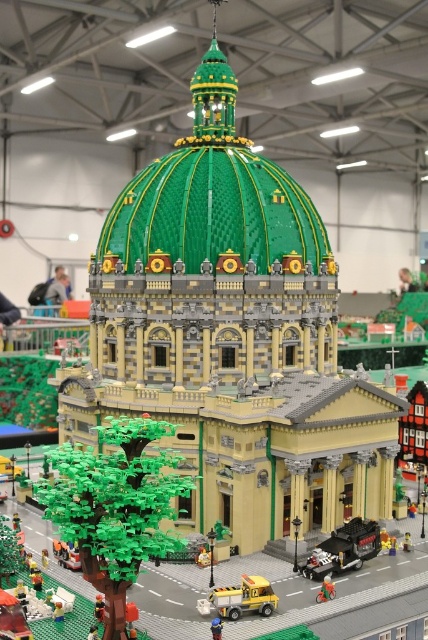
Question: Does dark gray plastic truck at center appear on the left side of brick-like toy car at lower left?

Choices:
 (A) yes
 (B) no

Answer: (B)

Question: Is green plastic tree at lower left to the right of metallic silver bicycle at center from the viewer's perspective?

Choices:
 (A) no
 (B) yes

Answer: (A)

Question: Among these objects, which one is nearest to the camera?

Choices:
 (A) blue plastic toy at lower center
 (B) yellow plastic truck at lower center

Answer: (A)

Question: Which point is farther to the camera?

Choices:
 (A) dark gray plastic truck at center
 (B) green plastic tree at lower left
 (C) metallic silver bicycle at center

Answer: (A)

Question: Among these objects, which one is nearest to the camera?

Choices:
 (A) dark gray plastic truck at center
 (B) yellow plastic car at center
 (C) blue plastic toy at lower center

Answer: (C)

Question: Is dark gray plastic truck at center below brick-like toy car at lower left?

Choices:
 (A) yes
 (B) no

Answer: (B)